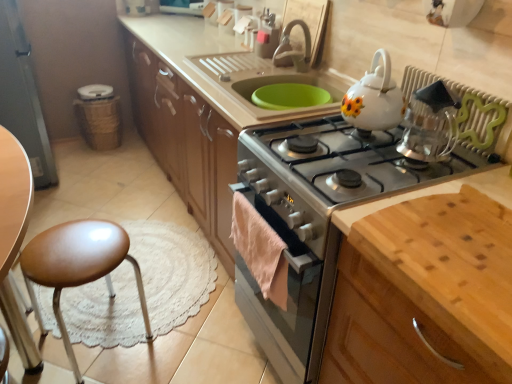
In order to face clear glass kettle at upper right, should I rotate leftwards or rightwards?

Rotate your view right by about 22.529°.

What do you see at coordinates (469, 113) in the screenshot?
I see `green plastic radiator at upper right` at bounding box center [469, 113].

The height and width of the screenshot is (384, 512). Describe the element at coordinates (374, 99) in the screenshot. I see `white glossy teapot at upper right` at that location.

Where is `silver metallic gas stove at center`? silver metallic gas stove at center is located at coordinates (340, 163).

Where is `gas stove that is under the clear glass kettle at upper right (from a real-world perspective)`? The image size is (512, 384). gas stove that is under the clear glass kettle at upper right (from a real-world perspective) is located at coordinates (340, 163).

Visually, is clear glass kettle at upper right positioned to the left or to the right of silver metallic gas stove at center?

clear glass kettle at upper right is positioned on silver metallic gas stove at center's right side.

Is clear glass kettle at upper right bigger than silver metallic gas stove at center?

Actually, clear glass kettle at upper right might be smaller than silver metallic gas stove at center.

Is green plastic radiator at upper right at the left side of clear glass kettle at upper right?

In fact, green plastic radiator at upper right is to the right of clear glass kettle at upper right.

Is green plastic radiator at upper right located outside clear glass kettle at upper right?

Indeed, green plastic radiator at upper right is completely outside clear glass kettle at upper right.

Which of these two, green plastic radiator at upper right or clear glass kettle at upper right, is bigger?

Bigger between the two is clear glass kettle at upper right.

From the picture: Is green plastic radiator at upper right aimed at clear glass kettle at upper right?

Yes, green plastic radiator at upper right is oriented towards clear glass kettle at upper right.

Could you tell me if silver metallic faucet at upper center is turned towards light brown wood cutting board at lower right?

No, silver metallic faucet at upper center does not turn towards light brown wood cutting board at lower right.

Which object is wider, silver metallic faucet at upper center or light brown wood cutting board at lower right?

light brown wood cutting board at lower right.

From the image's perspective, is silver metallic faucet at upper center over light brown wood cutting board at lower right?

Yes, from the image's perspective, silver metallic faucet at upper center is above light brown wood cutting board at lower right.

Which point is more distant from viewer, (297,61) or (340,288)?

Positioned behind is point (297,61).

Is green plastic radiator at upper right thinner than white glossy teapot at upper right?

Indeed, green plastic radiator at upper right has a lesser width compared to white glossy teapot at upper right.

From the image's perspective, who appears lower, green plastic radiator at upper right or white glossy teapot at upper right?

green plastic radiator at upper right, from the image's perspective.

Considering the sizes of green plastic radiator at upper right and white glossy teapot at upper right in the image, is green plastic radiator at upper right taller or shorter than white glossy teapot at upper right?

green plastic radiator at upper right is shorter than white glossy teapot at upper right.

From a real-world perspective, is green plastic radiator at upper right over white glossy teapot at upper right?

No, from a real-world perspective, green plastic radiator at upper right is not on top of white glossy teapot at upper right.

In the image, is light brown wood cutting board at lower right on the left side or the right side of brown leather stool at lower left?

light brown wood cutting board at lower right is to the right of brown leather stool at lower left.

Looking at their sizes, would you say light brown wood cutting board at lower right is wider or thinner than brown leather stool at lower left?

In the image, light brown wood cutting board at lower right appears to be wider than brown leather stool at lower left.

Is light brown wood cutting board at lower right aimed at brown leather stool at lower left?

No, light brown wood cutting board at lower right does not turn towards brown leather stool at lower left.

Can you confirm if green plastic radiator at upper right is thinner than silver metallic faucet at upper center?

Yes, green plastic radiator at upper right is thinner than silver metallic faucet at upper center.

From a real-world perspective, which object stands above the other?

silver metallic faucet at upper center.

Image resolution: width=512 pixels, height=384 pixels. In order to click on faucet above the green plastic radiator at upper right (from the image's perspective) in this screenshot , I will do `click(292, 49)`.

Is green plastic radiator at upper right positioned behind silver metallic faucet at upper center?

No, it is not.

Consider the image. Can you confirm if silver metallic gas stove at center is bigger than green plastic radiator at upper right?

Indeed, silver metallic gas stove at center has a larger size compared to green plastic radiator at upper right.

Between point (395, 129) and point (505, 132), which one is positioned in front?

The point (505, 132) is closer to the camera.

Is silver metallic gas stove at center oriented away from green plastic radiator at upper right?

silver metallic gas stove at center is not turned away from green plastic radiator at upper right.

In terms of height, does silver metallic gas stove at center look taller or shorter compared to green plastic radiator at upper right?

silver metallic gas stove at center is shorter than green plastic radiator at upper right.

What are the coordinates of `appliance on the right side of silver metallic gas stove at center` in the screenshot? It's located at (430, 123).

In the image, there is a clear glass kettle at upper right. In order to click on radiator below it (from a real-world perspective) in this screenshot , I will do `click(469, 113)`.

Looking at the image, which one is located closer to clear glass kettle at upper right, silver metallic faucet at upper center or silver metallic gas stove at center?

silver metallic gas stove at center is positioned closer to the anchor clear glass kettle at upper right.

When comparing their distances from white glossy teapot at upper right, does brown leather stool at lower left or light brown wood cutting board at lower right seem closer?

light brown wood cutting board at lower right is closer to white glossy teapot at upper right.

Which object lies nearer to the anchor point green plastic radiator at upper right, clear glass kettle at upper right or light brown wood cutting board at lower right?

clear glass kettle at upper right lies closer to green plastic radiator at upper right than the other object.

Which object lies nearer to the anchor point light brown wood cutting board at lower right, white glossy teapot at upper right or silver metallic faucet at upper center?

white glossy teapot at upper right.

Considering their positions, is silver metallic faucet at upper center positioned closer to green plastic radiator at upper right than light brown wood cutting board at lower right?

light brown wood cutting board at lower right lies closer to green plastic radiator at upper right than the other object.

Based on their spatial positions, is white glossy teapot at upper right or light brown wood cutting board at lower right closer to green plastic radiator at upper right?

white glossy teapot at upper right is closer to green plastic radiator at upper right.

Which object lies further to the anchor point clear glass kettle at upper right, light brown wood cutting board at lower right or green plastic radiator at upper right?

The object further to clear glass kettle at upper right is light brown wood cutting board at lower right.

Looking at the image, which one is located further to white glossy teapot at upper right, green plastic radiator at upper right or brown leather stool at lower left?

The object further to white glossy teapot at upper right is brown leather stool at lower left.

Locate an element on the screen. The width and height of the screenshot is (512, 384). gas stove located between brown leather stool at lower left and clear glass kettle at upper right in the left-right direction is located at coordinates (340, 163).

In order to click on gas stove between white glossy teapot at upper right and light brown wood cutting board at lower right vertically in this screenshot , I will do `click(340, 163)`.

Locate an element on the screen. kitchen appliance positioned between clear glass kettle at upper right and silver metallic faucet at upper center from near to far is located at coordinates (374, 99).

What are the coordinates of `appliance situated between silver metallic gas stove at center and green plastic radiator at upper right from left to right` in the screenshot? It's located at (430, 123).